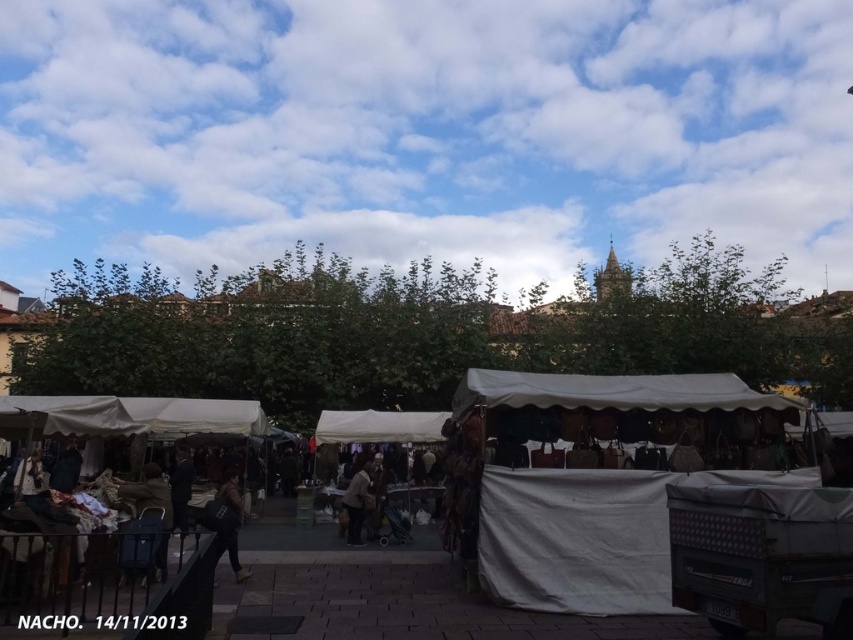
Question: Which object appears farthest from the camera in this image?

Choices:
 (A) white fabric tent at center
 (B) white fabric market stall at center

Answer: (A)

Question: Is white fabric market stall at center further to the viewer compared to white fabric canopy at center?

Choices:
 (A) no
 (B) yes

Answer: (A)

Question: Which object is closer to the camera taking this photo?

Choices:
 (A) white fabric tent at center
 (B) white fabric market stall at center
 (C) light brown fabric coat at center
 (D) dark gray fabric jacket at lower center

Answer: (B)

Question: Is the position of white fabric market stall at center less distant than that of light brown fabric coat at center?

Choices:
 (A) yes
 (B) no

Answer: (A)

Question: Which point appears farthest from the camera in this image?

Choices:
 (A) (363, 493)
 (B) (364, 436)

Answer: (B)

Question: Does white fabric tent at center appear on the left side of white fabric market stall at center?

Choices:
 (A) yes
 (B) no

Answer: (B)